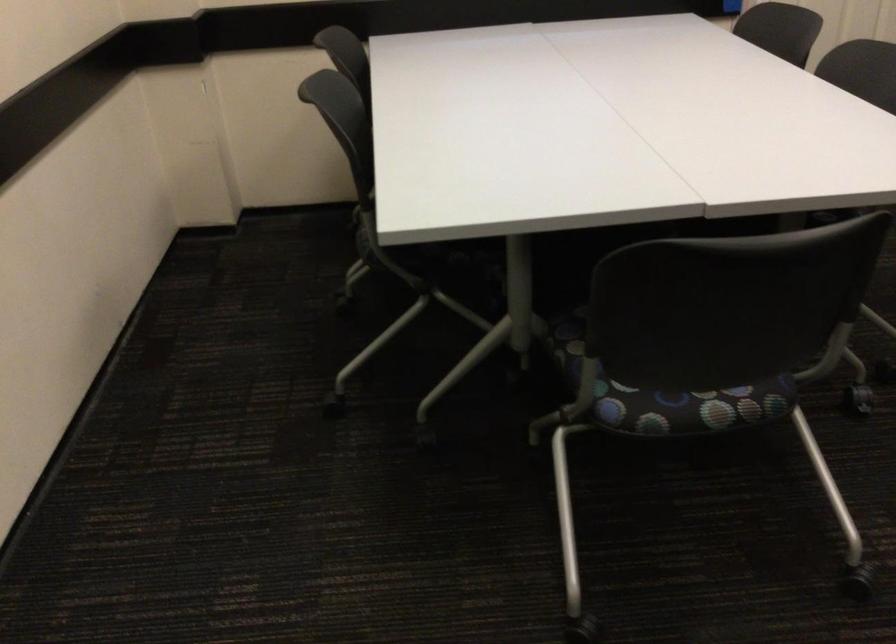
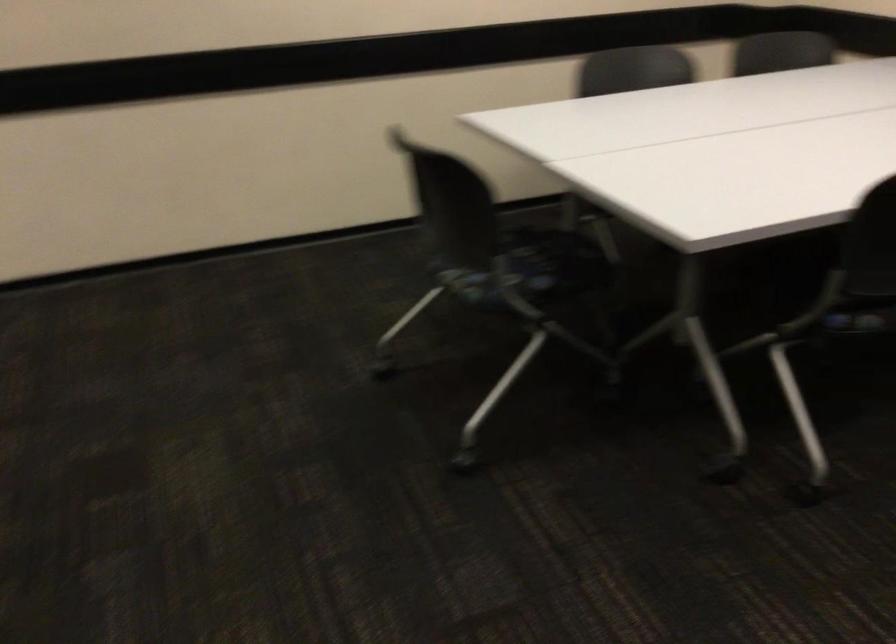
Find the pixel in the second image that matches pixel 734 383 in the first image.

(494, 285)